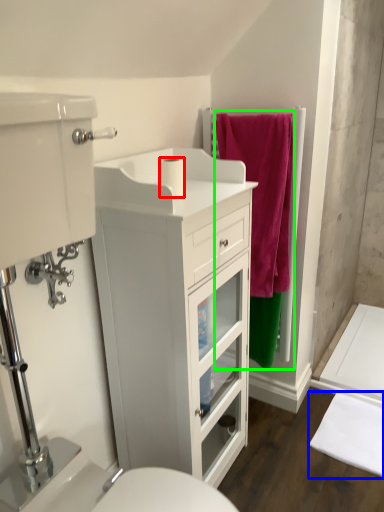
Question: Based on their relative distances, which object is nearer to toilet paper (highlighted by a red box)? Choose from bath mat (highlighted by a blue box) and bath towel (highlighted by a green box).

Choices:
 (A) bath mat
 (B) bath towel

Answer: (B)